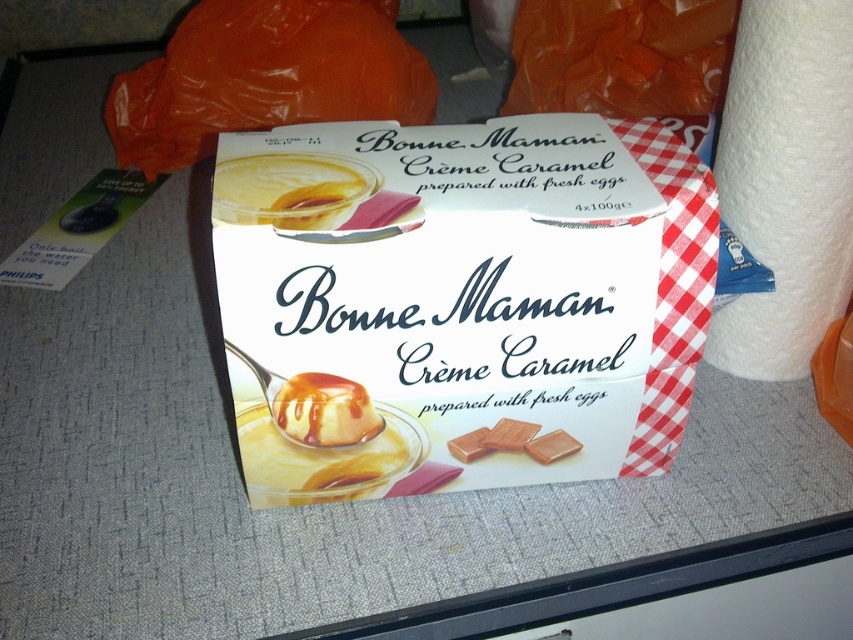
Who is shorter, white paper towel at right or white glossy creme caramel at center?

white glossy creme caramel at center

Does white paper towel at right appear over white glossy creme caramel at center?

Yes, white paper towel at right is above white glossy creme caramel at center.

Does point (752, 170) come in front of point (364, 412)?

No.

Find the location of a particular element. The image size is (853, 640). white paper towel at right is located at coordinates (786, 182).

Who is taller, yellow creamy pudding at center or white glossy creme caramel at center?

Standing taller between the two is yellow creamy pudding at center.

Between yellow creamy pudding at center and white glossy creme caramel at center, which one is positioned lower?

Positioned lower is white glossy creme caramel at center.

The width and height of the screenshot is (853, 640). Identify the location of yellow creamy pudding at center. (289, 189).

Locate an element on the screen. The width and height of the screenshot is (853, 640). yellow creamy pudding at center is located at coordinates (289, 189).

Is white paper towel at right positioned at the back of yellow creamy pudding at center?

Yes, it is.

Find the location of a particular element. The width and height of the screenshot is (853, 640). white paper towel at right is located at coordinates (786, 182).